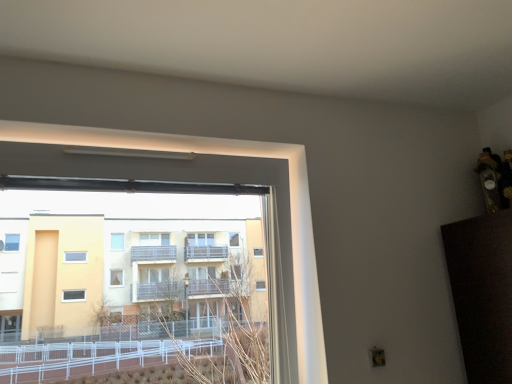
Question: Should I look upward or downward to see transparent glass window at left?

Choices:
 (A) up
 (B) down

Answer: (B)